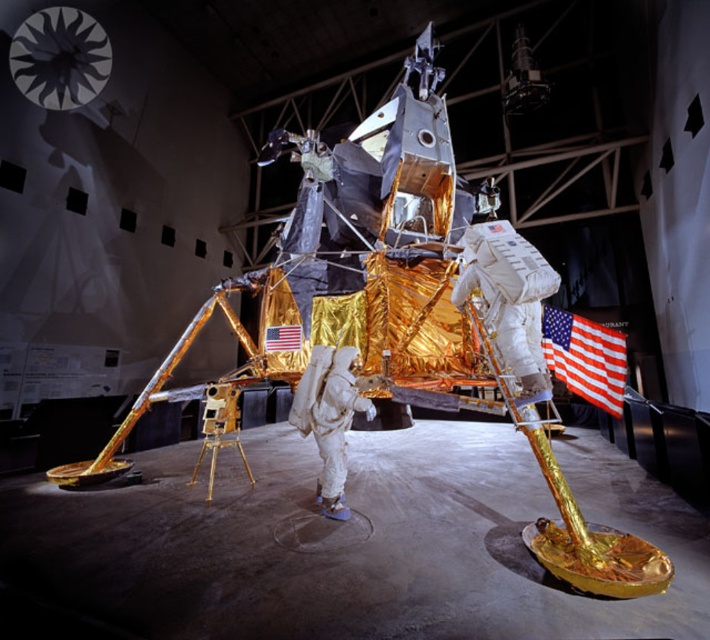
You are standing in front of the Apollo Lunar Module model in the museum. There are two points marked on the model, one at coordinates point [131,550] and another at point [89,99]. Which of these points is closer to you?

Point [131,550] is closer to the viewer than point [89,99].